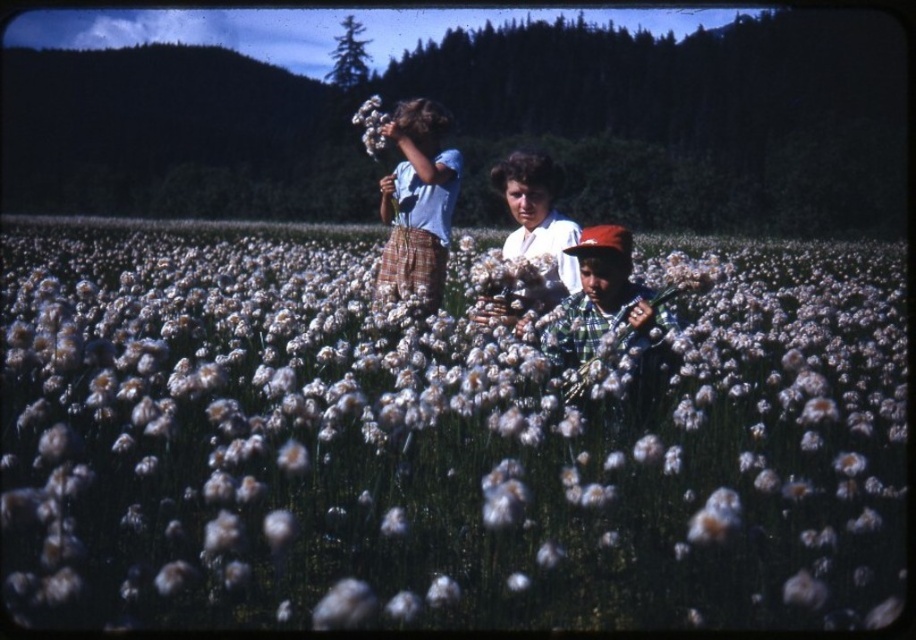
You are standing in the field of white fluffy flowers at center. If you walk straight ahead, will you eventually reach the woman in the center?

Yes, walking straight ahead in the field of white fluffy flowers at center will lead you to the woman in the center because she is positioned directly ahead in the middle ground.

You are a farmer who needs to collect cotton for a project. You see the white fluffy flowers at center and the white cotton at center in the field. Which one is closer to you?

The white cotton at center is closer to you since the white fluffy flowers at center are 4.18 meters away from it.

You are a photographer trying to frame a shot of the plaid flannel shirt at center and the light blue cotton shirt at upper center. Which shirt should you focus on if you want to capture the one that is shorter in the scene?

The plaid flannel shirt at center has a lesser height compared to the light blue cotton shirt at upper center, so you should focus on the plaid flannel shirt at center to capture the shorter one.